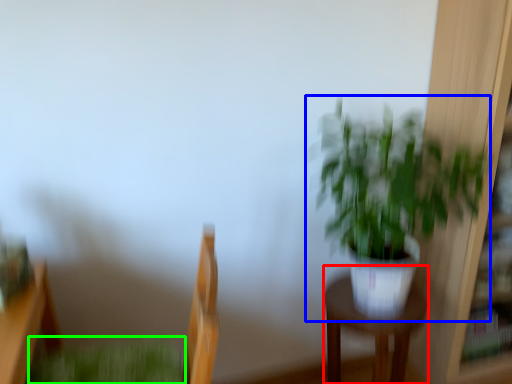
Question: Based on their relative distances, which object is farther from furniture (highlighted by a red box)? Choose from houseplant (highlighted by a blue box) and plant (highlighted by a green box).

Choices:
 (A) houseplant
 (B) plant

Answer: (B)